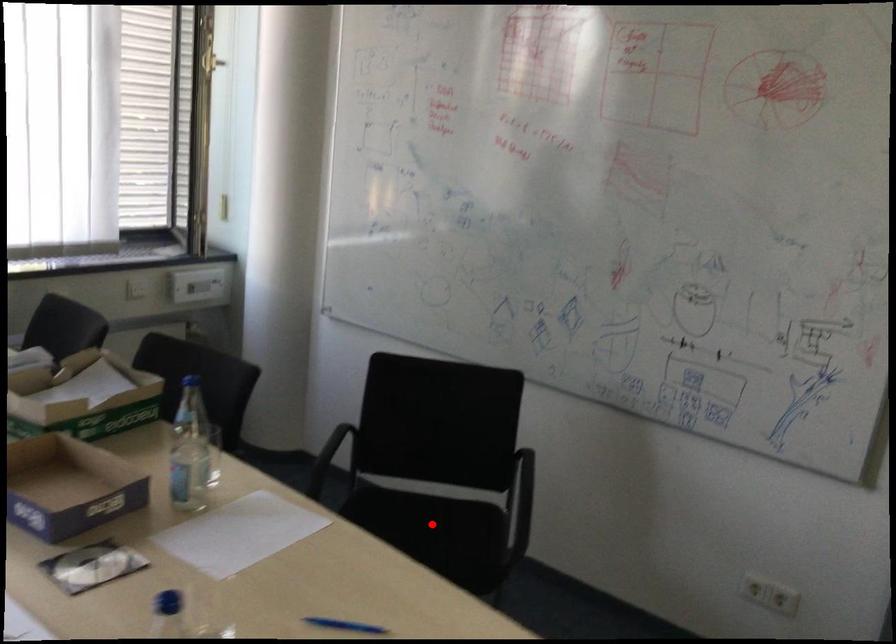
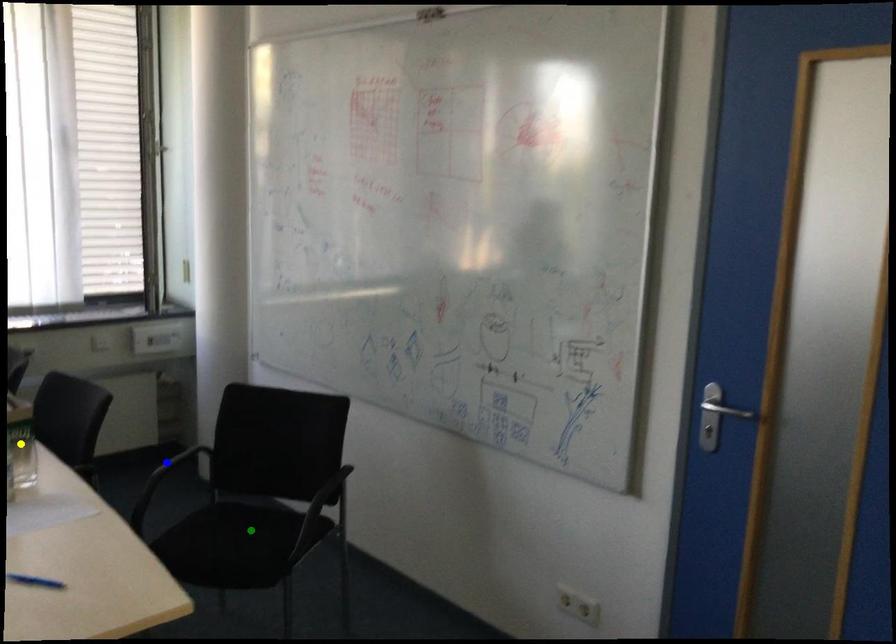
Question: I am providing you with two images of the same scene from different viewpoints. A red point is marked on the first image. You are given multiple points on the second image. In image 2, which mark is for the same physical point as the one in image 1?

Choices:
 (A) green point
 (B) blue point
 (C) yellow point

Answer: (A)